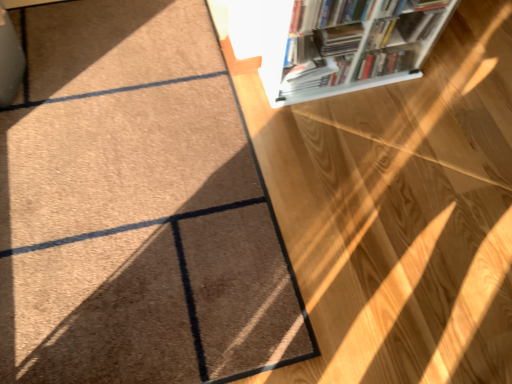
Question: From their relative heights in the image, would you say brown carpet at upper left is taller or shorter than white plastic bookcase at upper right?

Choices:
 (A) tall
 (B) short

Answer: (B)

Question: In the image, is brown carpet at upper left positioned in front of or behind white plastic bookcase at upper right?

Choices:
 (A) behind
 (B) front

Answer: (B)

Question: Considering the positions of point (47, 180) and point (380, 29), is point (47, 180) closer or farther from the camera than point (380, 29)?

Choices:
 (A) closer
 (B) farther

Answer: (A)

Question: Is white plastic bookcase at upper right wider or thinner than brown carpet at upper left?

Choices:
 (A) thin
 (B) wide

Answer: (A)

Question: From the image's perspective, is white plastic bookcase at upper right positioned above or below brown carpet at upper left?

Choices:
 (A) above
 (B) below

Answer: (A)

Question: Considering the positions of point pyautogui.click(x=435, y=31) and point pyautogui.click(x=218, y=215), is point pyautogui.click(x=435, y=31) closer or farther from the camera than point pyautogui.click(x=218, y=215)?

Choices:
 (A) farther
 (B) closer

Answer: (A)

Question: Based on their sizes in the image, would you say white plastic bookcase at upper right is bigger or smaller than brown carpet at upper left?

Choices:
 (A) big
 (B) small

Answer: (A)